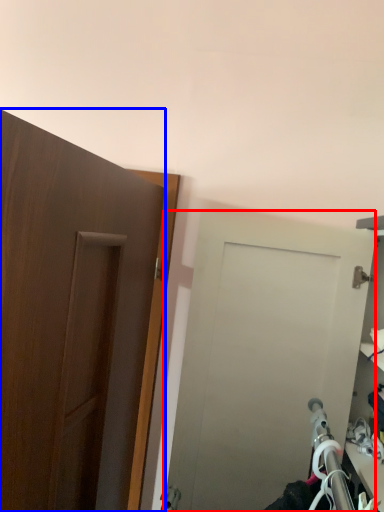
Question: Which of the following is the closest to the observer, door (highlighted by a red box) or door (highlighted by a blue box)?

Choices:
 (A) door
 (B) door

Answer: (B)